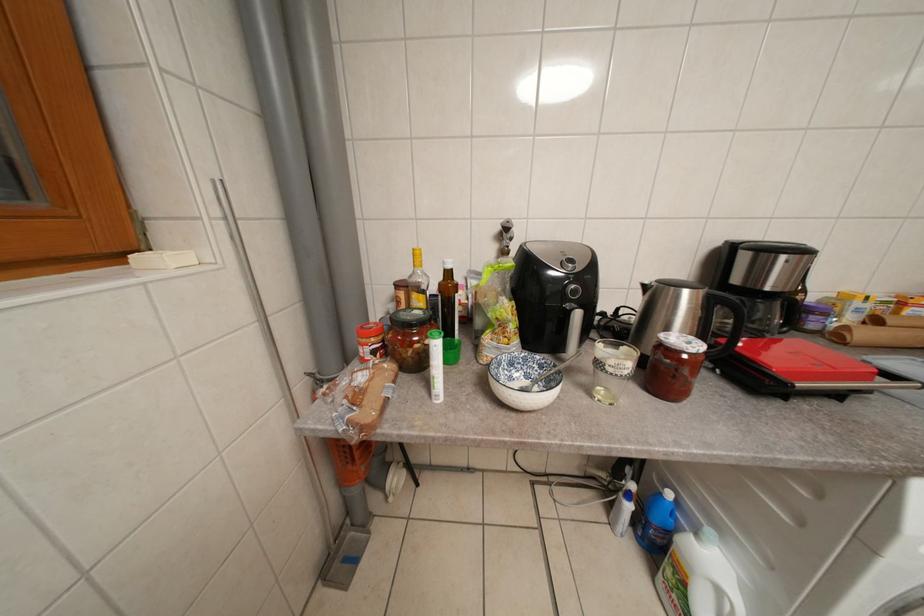
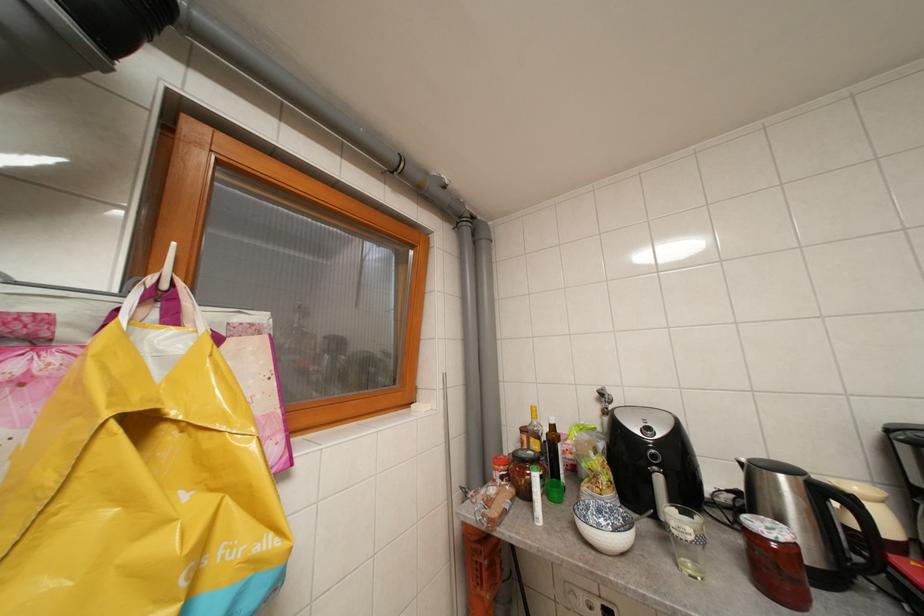
First-person continuous shooting, in which direction is the camera rotating?

The camera's rotation is toward left-up.